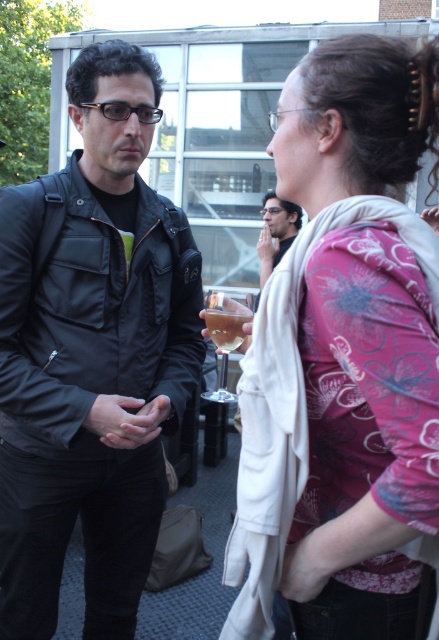
Question: Which is nearer to the matte black jacket at left?

Choices:
 (A) clear glass wine glass at center
 (B) translucent glass cup at center
 (C) pink floral sweater at upper right
 (D) matte black jacket at center

Answer: (B)

Question: Considering the real-world distances, which object is closest to the translucent glass cup at center?

Choices:
 (A) matte black jacket at center
 (B) matte black jacket at left

Answer: (B)

Question: Estimate the real-world distances between objects in this image. Which object is farther from the pink floral sweater at upper right?

Choices:
 (A) matte black jacket at center
 (B) clear glass wine glass at center
 (C) matte black jacket at left

Answer: (B)

Question: Is matte black jacket at left to the right of clear glass wine glass at center from the viewer's perspective?

Choices:
 (A) no
 (B) yes

Answer: (A)

Question: Is matte black jacket at left thinner than clear glass wine glass at center?

Choices:
 (A) no
 (B) yes

Answer: (A)

Question: Can you confirm if matte black jacket at center is smaller than translucent glass cup at center?

Choices:
 (A) no
 (B) yes

Answer: (A)